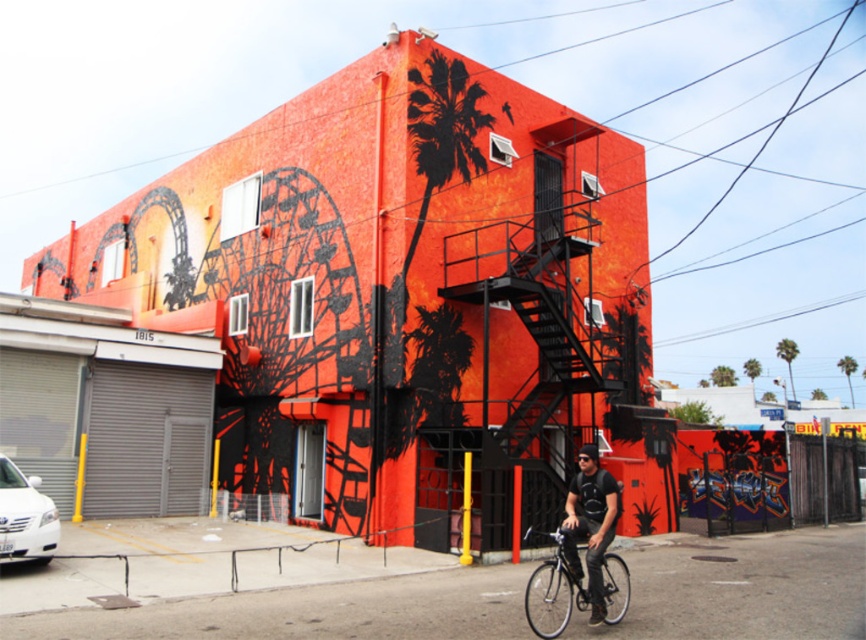
You are a delivery person trying to park your shiny silver bicycle at lower center near the entrance of the building. However, there is another matte black bicycle at lower right blocking the path. From the perspective of someone standing at the entrance, which bicycle would appear closer to you?

The shiny silver bicycle at lower center is in front of the matte black bicycle at lower right, so it would appear closer to someone standing at the entrance.

You are a delivery person who needs to park your shiny silver bicycle at lower center and matte black bicycle at lower right near the entrance of the building. Which bicycle is closer to the entrance?

The shiny silver bicycle at lower center is closer to the entrance because it is located below the matte black bicycle at lower right, indicating it is positioned lower and nearer to the entrance.

Based on the photo, you are standing in front of the building and want to determine the relative positions of two points marked on the facade. Which point is closer to you, point 1 at coordinates (561, 630) or point 2 at coordinates (615, 515)?

Point 1 at coordinates (561, 630) is closer to the viewer than point 2 at coordinates (615, 515).